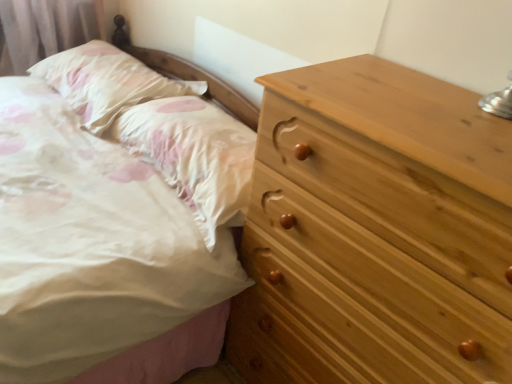
Question: Considering the positions of white satin pillow at upper left, the 1th pillow viewed from the left, and white satin pillow at upper left, which appears as the 1th pillow when viewed from the right, in the image, is white satin pillow at upper left, the 1th pillow viewed from the left, wider or thinner than white satin pillow at upper left, which appears as the 1th pillow when viewed from the right,?

Choices:
 (A) wide
 (B) thin

Answer: (B)

Question: From the image's perspective, is white satin pillow at upper left, the 1th pillow viewed from the left, above or below white satin pillow at upper left, which appears as the 1th pillow when viewed from the right?

Choices:
 (A) above
 (B) below

Answer: (A)

Question: Based on their relative distances, which object is nearer to the white satin pillow at upper left, acting as the 2th pillow starting from the right?

Choices:
 (A) natural wood chest of drawers at right
 (B) white satin pillow at upper left, which appears as the 1th pillow when viewed from the right

Answer: (B)

Question: Estimate the real-world distances between objects in this image. Which object is farther from the white satin pillow at upper left, which is counted as the 2th pillow, starting from the left?

Choices:
 (A) natural wood chest of drawers at right
 (B) white satin pillow at upper left, the 1th pillow viewed from the left

Answer: (A)